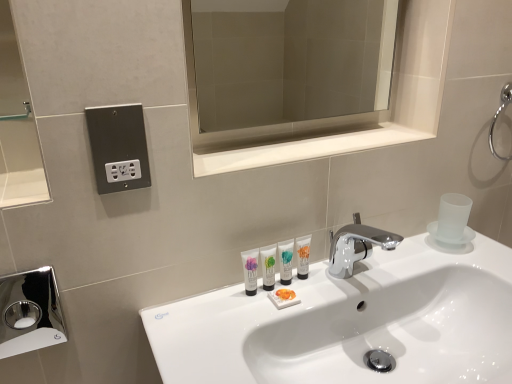
I want to click on free space in front of white glossy tube at center, the first mouthwash in the left-to-right sequence, so click(x=231, y=335).